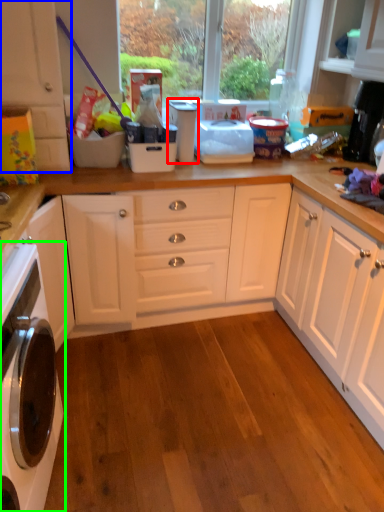
Question: Based on their relative distances, which object is farther from appliance (highlighted by a red box)? Choose from cabinetry (highlighted by a blue box) and home appliance (highlighted by a green box).

Choices:
 (A) cabinetry
 (B) home appliance

Answer: (B)